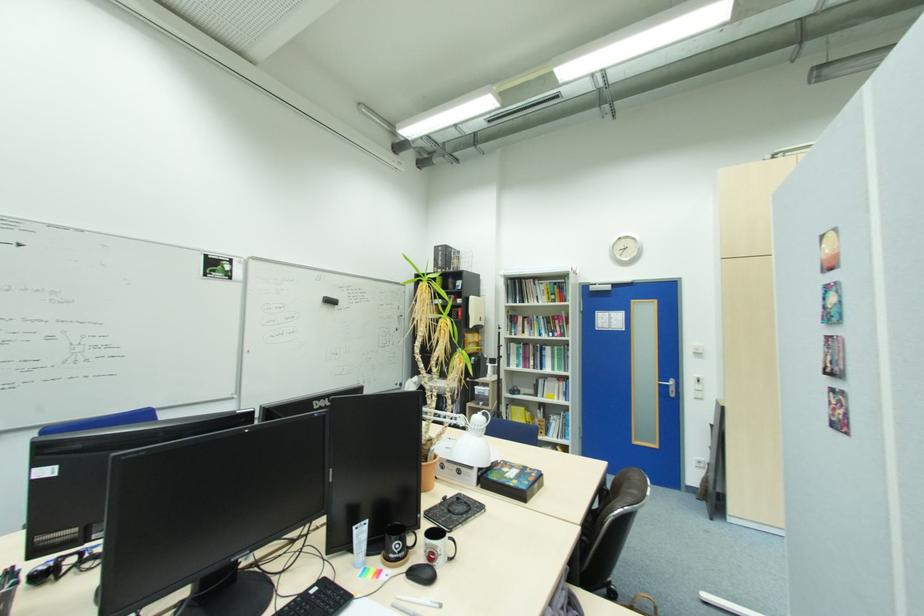
Image resolution: width=924 pixels, height=616 pixels. Find the location of `silver door handle`. silver door handle is located at coordinates (670, 387).